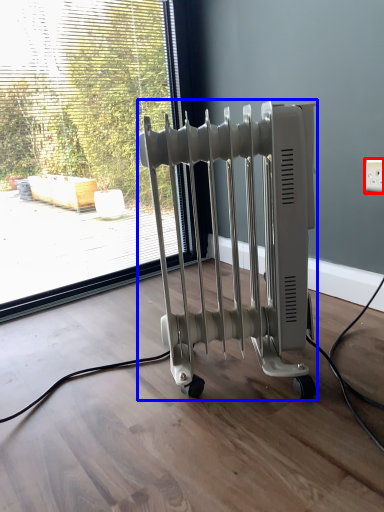
Question: Among these objects, which one is nearest to the camera, electric outlet (highlighted by a red box) or bath heater (highlighted by a blue box)?

Choices:
 (A) electric outlet
 (B) bath heater

Answer: (B)